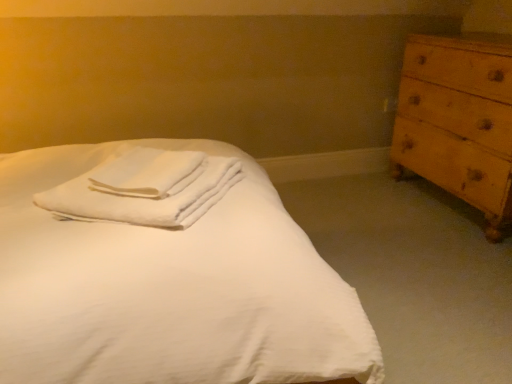
This screenshot has height=384, width=512. In order to click on free region on the left part of wooden chest of drawers at right in this screenshot , I will do `click(360, 211)`.